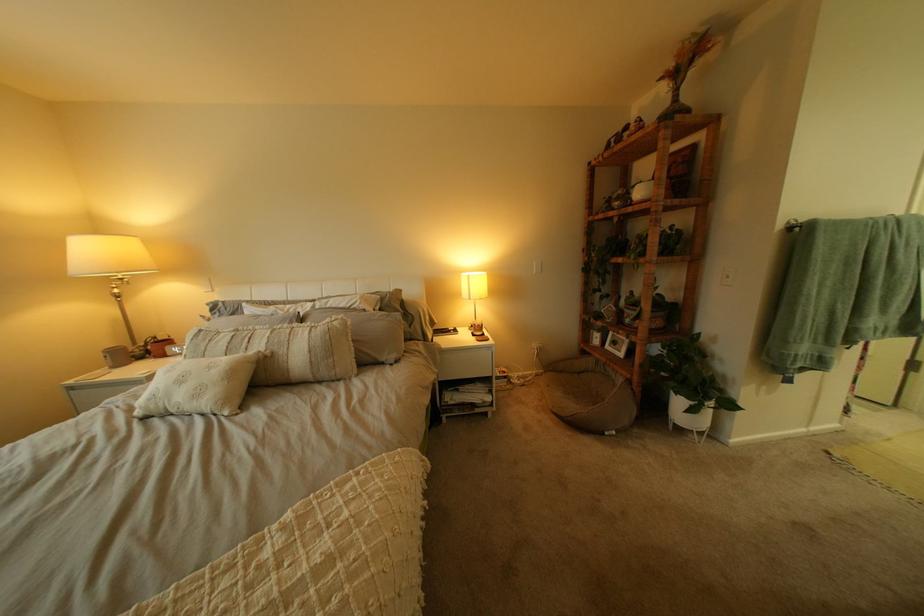
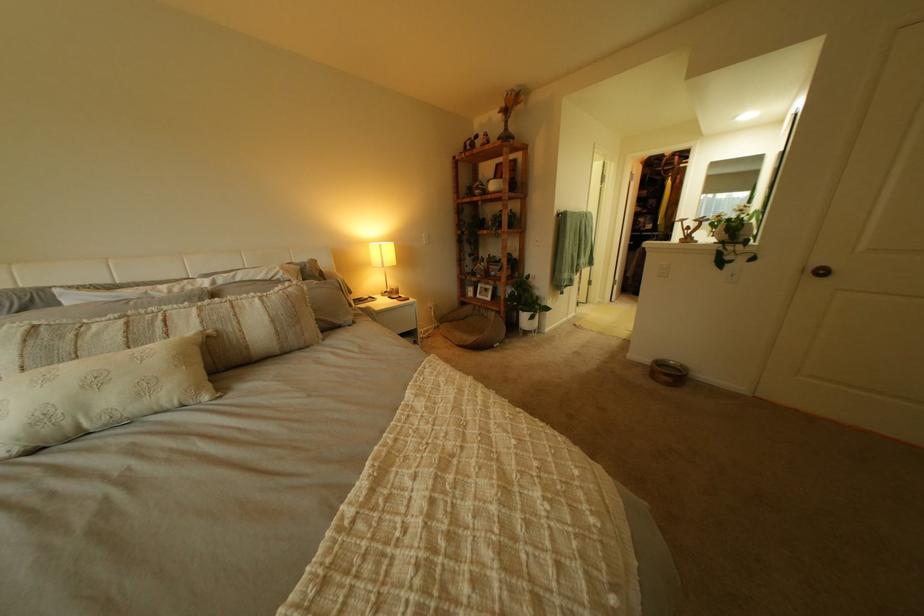
In the second image, find the point that corresponds to point 650,385 in the first image.

(517, 314)